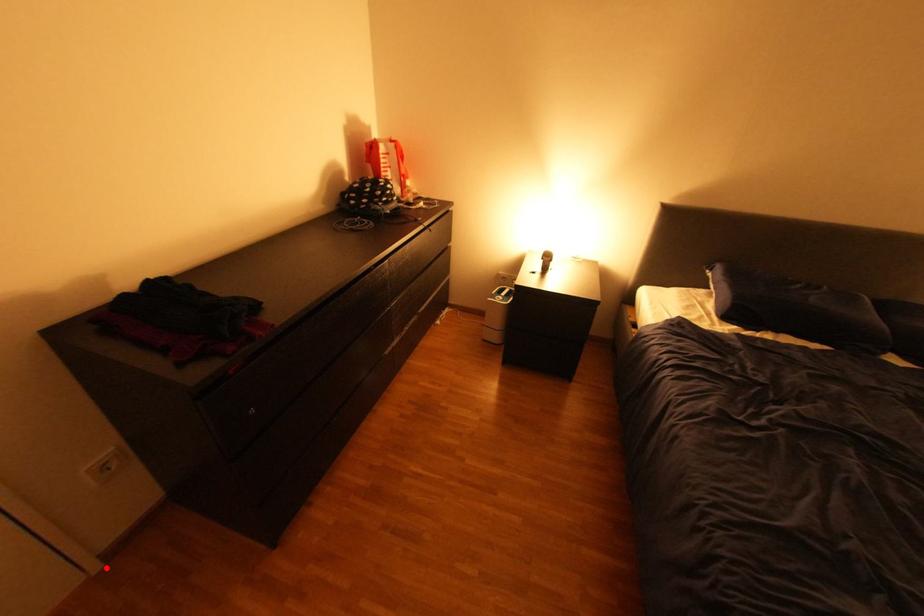
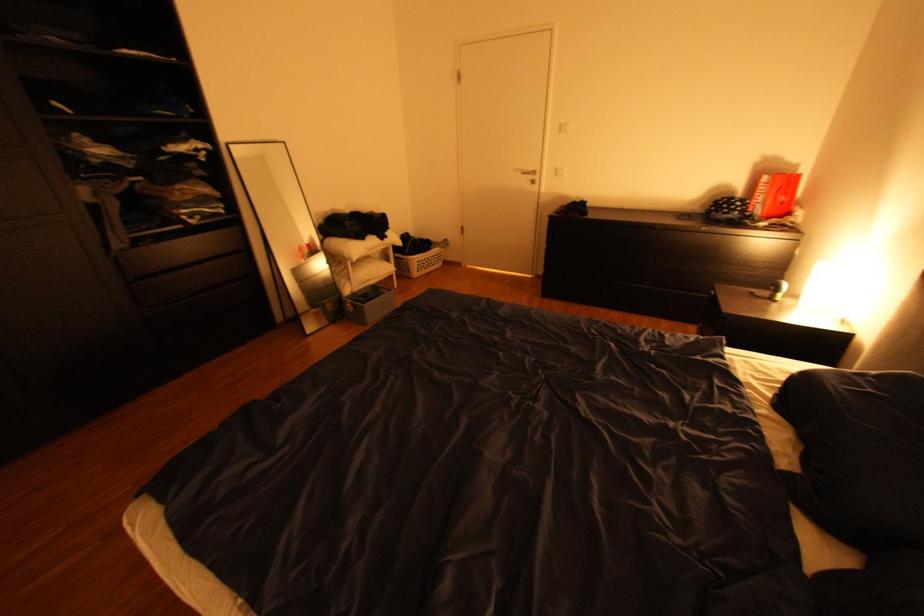
Where in the second image is the point corresponding to the highlighted location from the first image?

(543, 276)